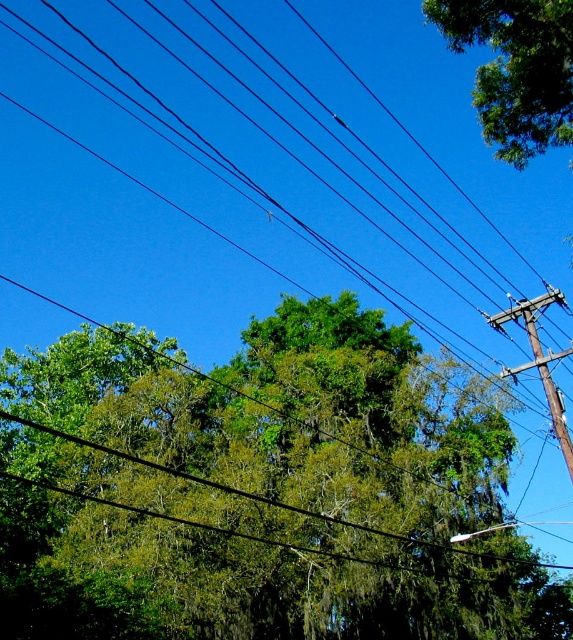
Question: Among these objects, which one is nearest to the camera?

Choices:
 (A) green leafy tree at upper right
 (B) green leafy tree at center

Answer: (B)

Question: Does green leafy tree at center have a greater width compared to green leafy tree at upper right?

Choices:
 (A) yes
 (B) no

Answer: (A)

Question: Which of the following is the closest to the observer?

Choices:
 (A) green leafy tree at center
 (B) green leafy tree at upper right

Answer: (A)

Question: Does green leafy tree at center have a lesser width compared to green leafy tree at upper right?

Choices:
 (A) yes
 (B) no

Answer: (B)

Question: Which object is closer to the camera taking this photo?

Choices:
 (A) green leafy tree at upper right
 (B) green leafy tree at center

Answer: (B)

Question: Can you confirm if green leafy tree at center is smaller than green leafy tree at upper right?

Choices:
 (A) no
 (B) yes

Answer: (A)